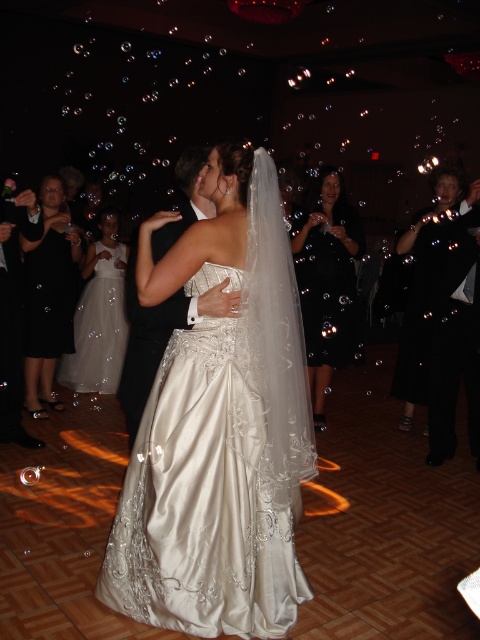
Can you confirm if black satin dress at right is positioned to the right of black satin dress at left?

Yes, black satin dress at right is to the right of black satin dress at left.

Is black satin dress at right positioned before black satin dress at left?

Yes, it is in front of black satin dress at left.

The width and height of the screenshot is (480, 640). What do you see at coordinates (447, 308) in the screenshot?
I see `black satin dress at right` at bounding box center [447, 308].

At what (x,y) coordinates should I click in order to perform the action: click on black satin dress at right. Please return your answer as a coordinate pair (x, y). Looking at the image, I should click on (447, 308).

Is point (133, 413) farther from viewer compared to point (109, 289)?

No, (133, 413) is closer to viewer.

Is point (133, 381) more distant than point (108, 333)?

No.

The width and height of the screenshot is (480, 640). What are the coordinates of `black satin suit at center` in the screenshot? It's located at (154, 337).

Between point (439, 380) and point (322, 365), which one is positioned in front?

Point (439, 380) is in front.

In the scene shown: Which is more to the right, black satin dress at right or black satin dress at center?

From the viewer's perspective, black satin dress at right appears more on the right side.

Does point (448, 339) lie in front of point (337, 246)?

Yes, it is in front of point (337, 246).

Find the location of `black satin dress at right`. black satin dress at right is located at coordinates (447, 308).